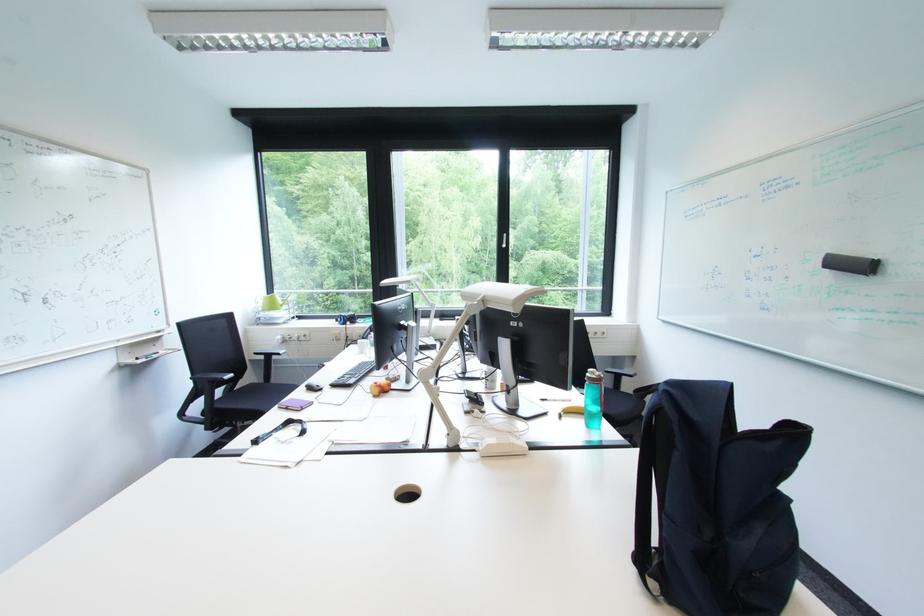
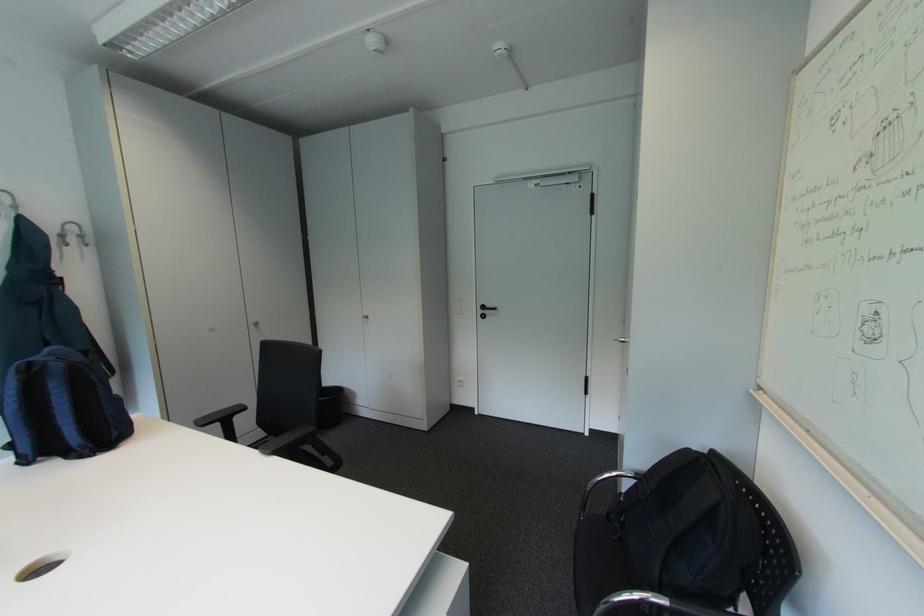
The point at [675,394] is marked in the first image. Where is the corresponding point in the second image?

(67, 360)